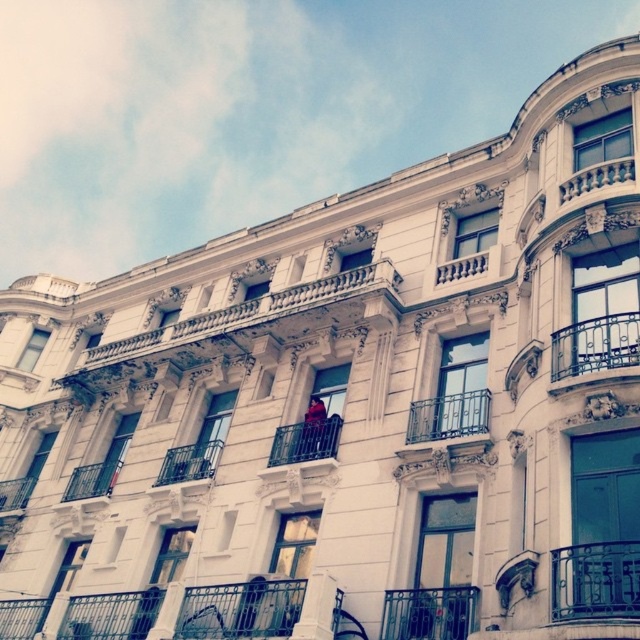
You are a painter who needs to set up an easel on the white stone balcony at center and the metallic balcony at lower left. Considering their widths, which balcony will allow you to place your easel without it hanging over the edge?

The white stone balcony at center has a larger width than the metallic balcony at lower left, so the easel can be placed safely without overhanging on the white stone balcony at center.

In the scene shown: You are a painter who needs to set up an easel. You have a limited amount of space. Which object, the white stone balcony at center or the metallic railing at center, would provide more space for your easel?

The white stone balcony at center is bigger than the metallic railing at center, so the white stone balcony at center would provide more space for your easel.